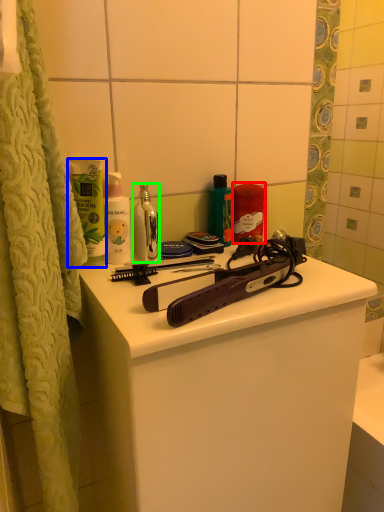
Question: Based on their relative distances, which object is farther from cleaning product (highlighted by a red box)? Choose from mouthwash (highlighted by a blue box) and mouthwash (highlighted by a green box).

Choices:
 (A) mouthwash
 (B) mouthwash

Answer: (A)